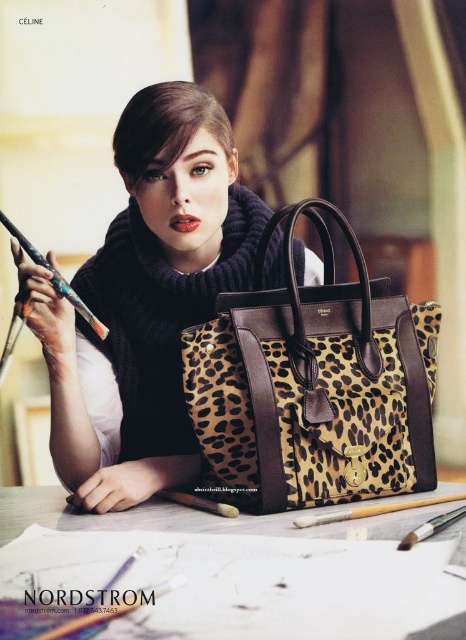
Is matte black sweater at center wider than leather table at center?

No.

Does matte black sweater at center appear on the right side of leather table at center?

In fact, matte black sweater at center is to the left of leather table at center.

Is point (165, 392) positioned behind point (77, 524)?

Yes, it is behind point (77, 524).

Locate an element on the screen. The width and height of the screenshot is (466, 640). matte black sweater at center is located at coordinates (144, 300).

Is leather table at center in front of wooden pencil at upper left?

Yes, it is in front of wooden pencil at upper left.

Which is more to the left, leather table at center or wooden pencil at upper left?

wooden pencil at upper left is more to the left.

The width and height of the screenshot is (466, 640). What are the coordinates of `leather table at center` in the screenshot? It's located at (168, 518).

Is point (116, 324) behind point (6, 225)?

Yes, it is behind point (6, 225).

You are a GUI agent. You are given a task and a screenshot of the screen. Output one action in this format:
    pyautogui.click(x=<x>, y=<y>)
    Task: Click on the matte black sweater at center
    The image size is (466, 640).
    Given the screenshot: What is the action you would take?
    pyautogui.click(x=144, y=300)

Image resolution: width=466 pixels, height=640 pixels. In order to click on matte black sweater at center in this screenshot , I will do `click(144, 300)`.